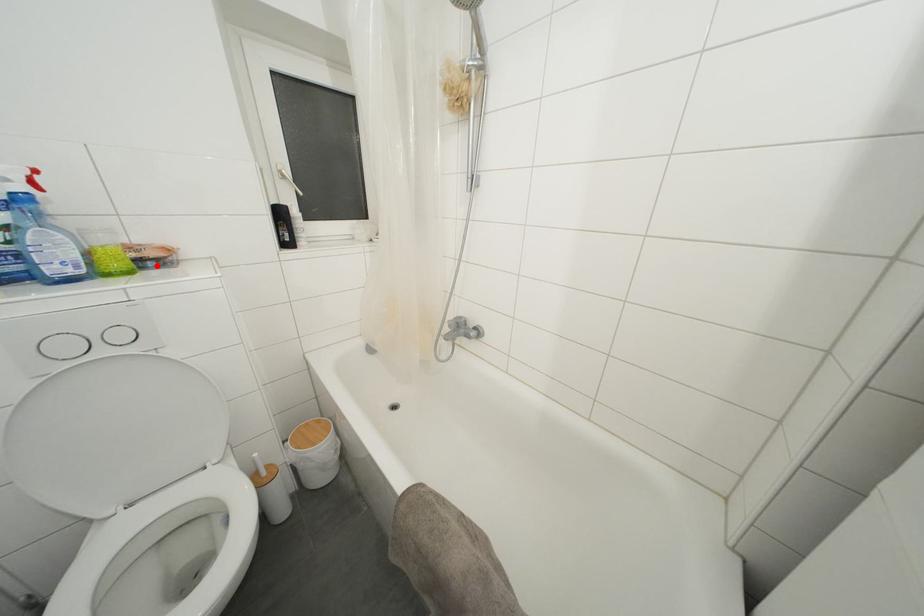
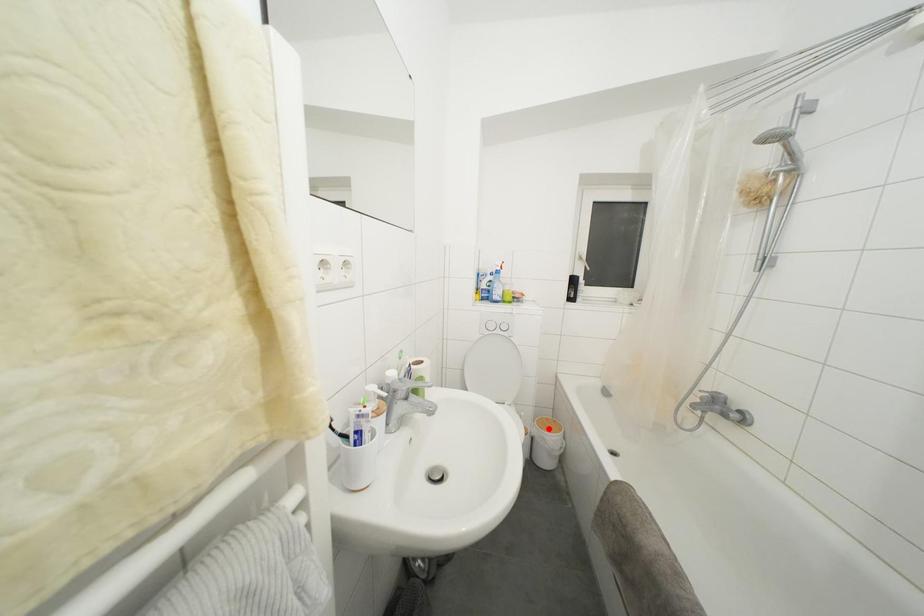
I am providing you with two images of the same scene from different viewpoints. A red point is marked on the first image and another point is marked on the second image. Does the point marked in image1 correspond to the same location as the one in image2?

No